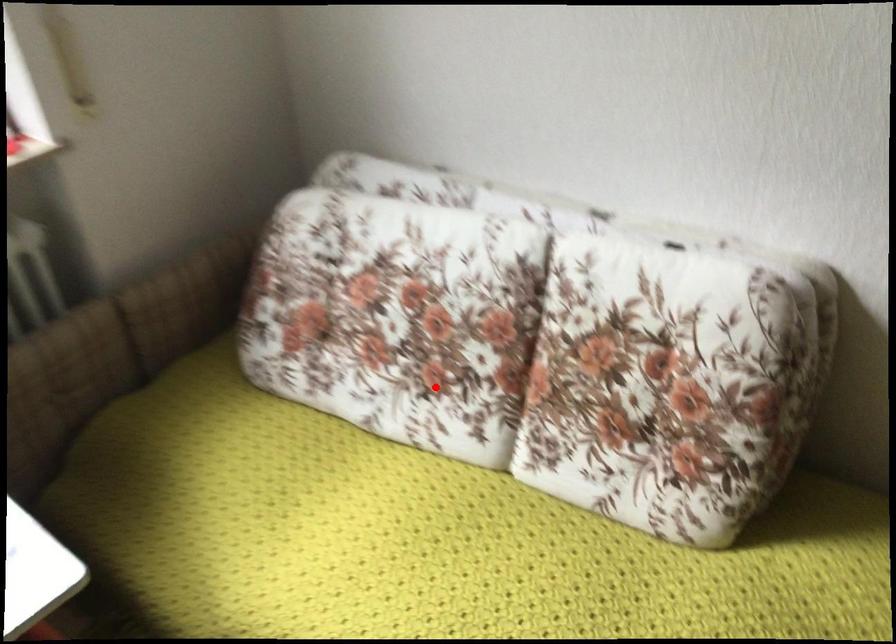
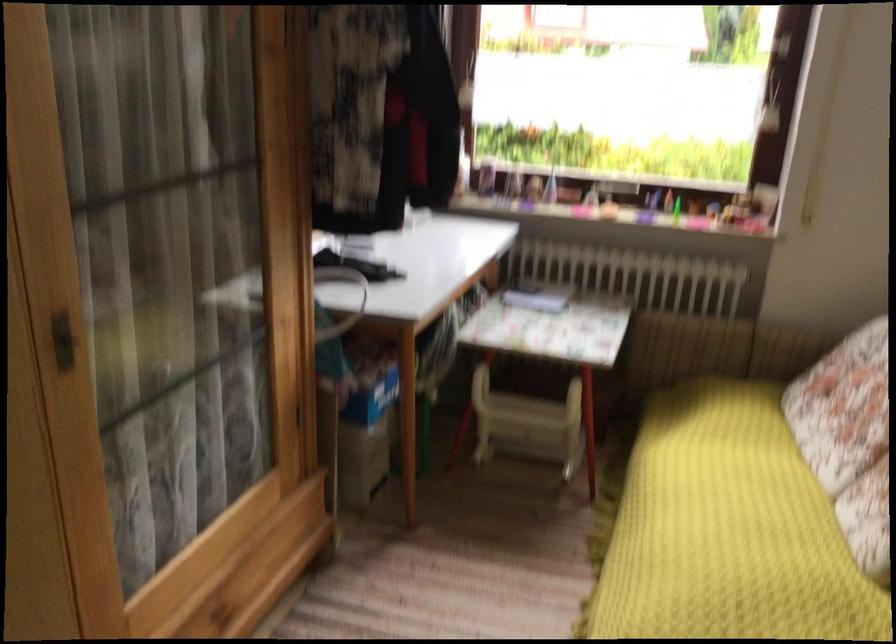
In the second image, find the point that corresponds to the highlighted location in the first image.

(849, 439)